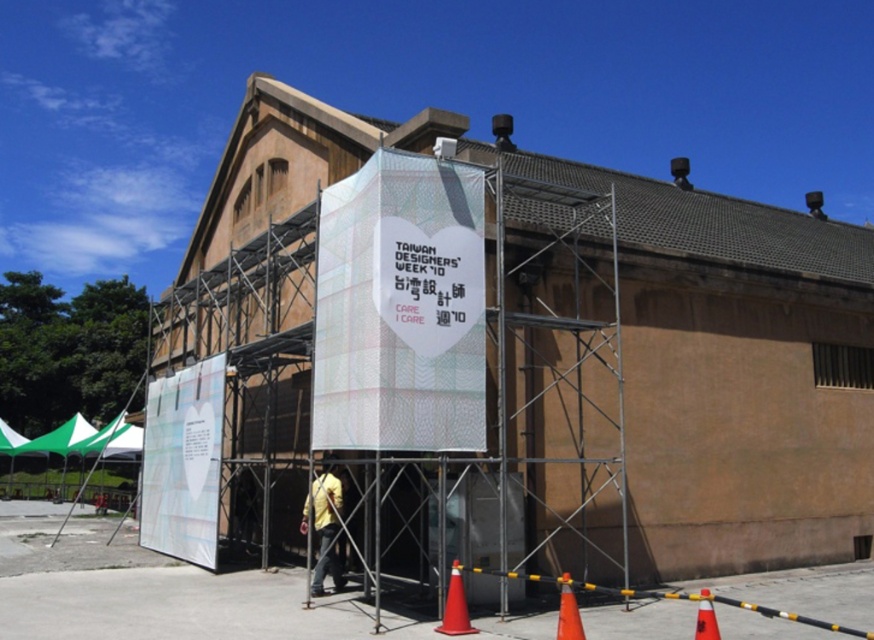
Is yellow matte shirt at center further to the viewer compared to orange matte traffic cone at lower right?

Yes, yellow matte shirt at center is behind orange matte traffic cone at lower right.

Does yellow matte shirt at center have a smaller size compared to orange matte traffic cone at lower right?

Actually, yellow matte shirt at center might be larger than orange matte traffic cone at lower right.

Who is more forward, (303, 506) or (705, 612)?

Point (705, 612) is more forward.

Identify the location of yellow matte shirt at center. The image size is (874, 640). (325, 525).

Who is lower down, transparent fabric banner at center or orange matte traffic cone at lower right?

orange matte traffic cone at lower right is lower down.

Between point (469, 225) and point (708, 612), which one is positioned in front?

Point (708, 612)

Image resolution: width=874 pixels, height=640 pixels. I want to click on transparent fabric banner at center, so click(x=400, y=308).

Can you confirm if yellow matte shirt at center is positioned above orange matte cone at lower right?

Indeed, yellow matte shirt at center is positioned over orange matte cone at lower right.

Can you confirm if yellow matte shirt at center is bigger than orange matte cone at lower right?

Yes, yellow matte shirt at center is bigger than orange matte cone at lower right.

Which is behind, point (334, 522) or point (560, 604)?

The point (334, 522) is more distant.

The width and height of the screenshot is (874, 640). What are the coordinates of `yellow matte shirt at center` in the screenshot? It's located at (325, 525).